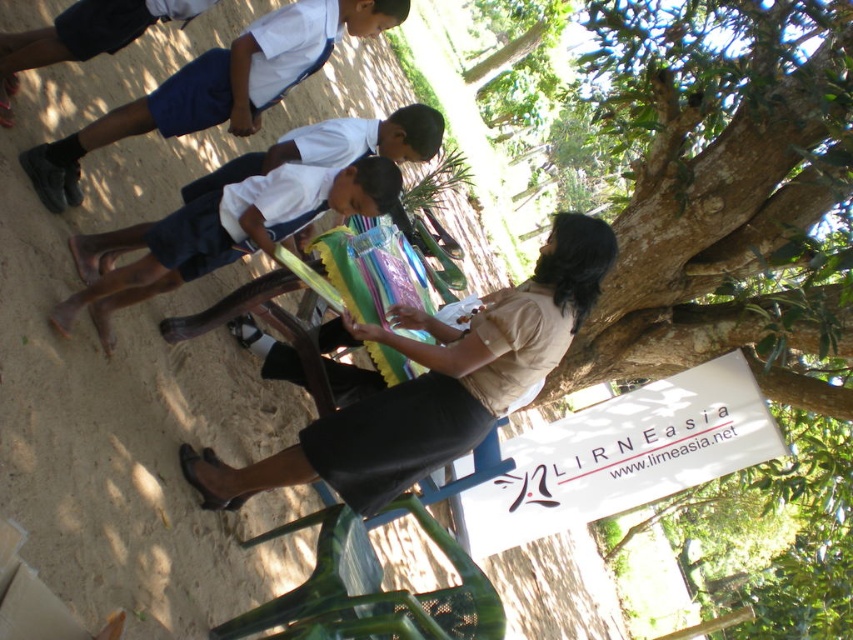
You are a photographer trying to capture a group photo of the white uniform shirt at upper left and the white fabric shirt at upper left. The camera you are using has a minimum focus distance of 8 centimeters. Can you focus on both shirts simultaneously without moving the camera?

The white uniform shirt at upper left and white fabric shirt at upper left are 8.01 centimeters apart from each other. Since the distance between them is slightly more than the camera minimum focus distance of 8 centimeters, you can focus on both shirts simultaneously without moving the camera.